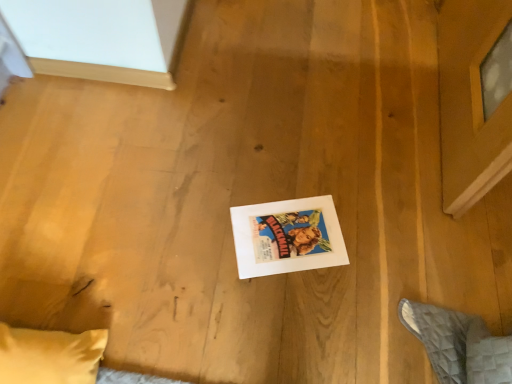
I want to click on vacant space behind white paper at center, so click(x=286, y=169).